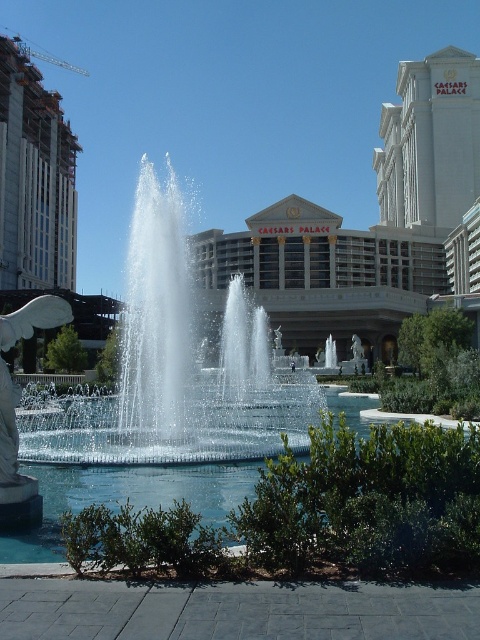
Which is in front, point (238, 458) or point (8, 346)?

Point (8, 346) is more forward.

Does clear glass water at center lie in front of white marble statue at left?

No.

The image size is (480, 640). Identify the location of clear glass water at center. (176, 369).